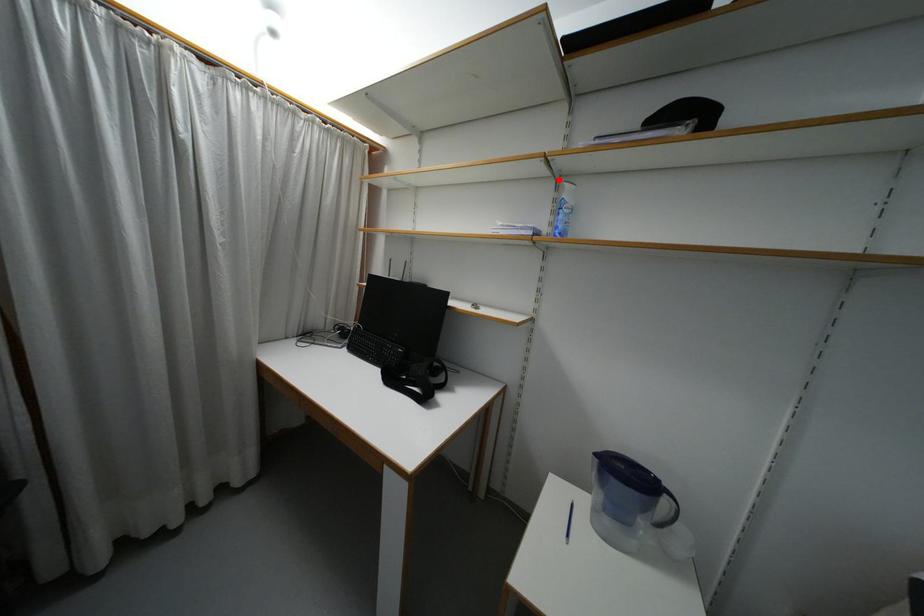
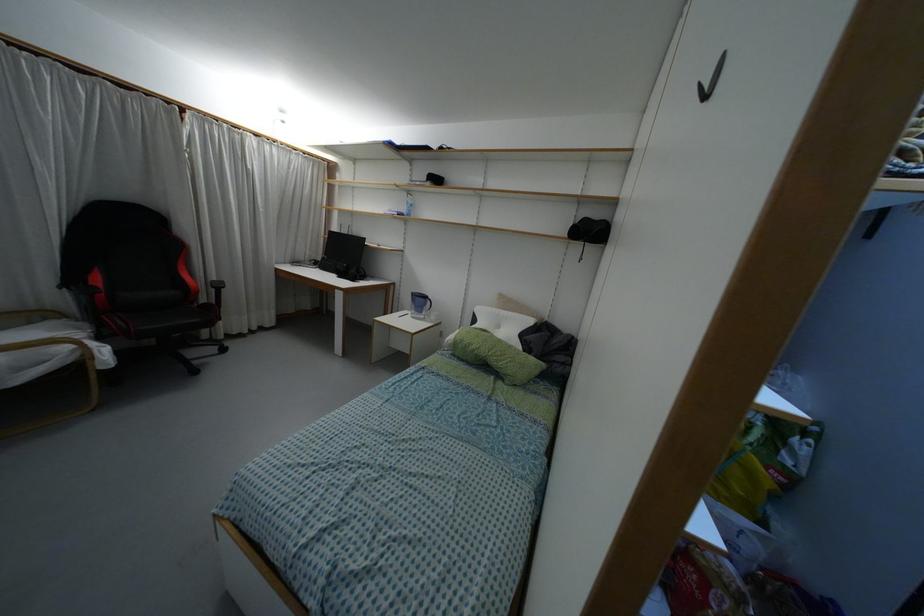
In the second image, find the point that corresponds to the highlighted location in the first image.

(407, 192)